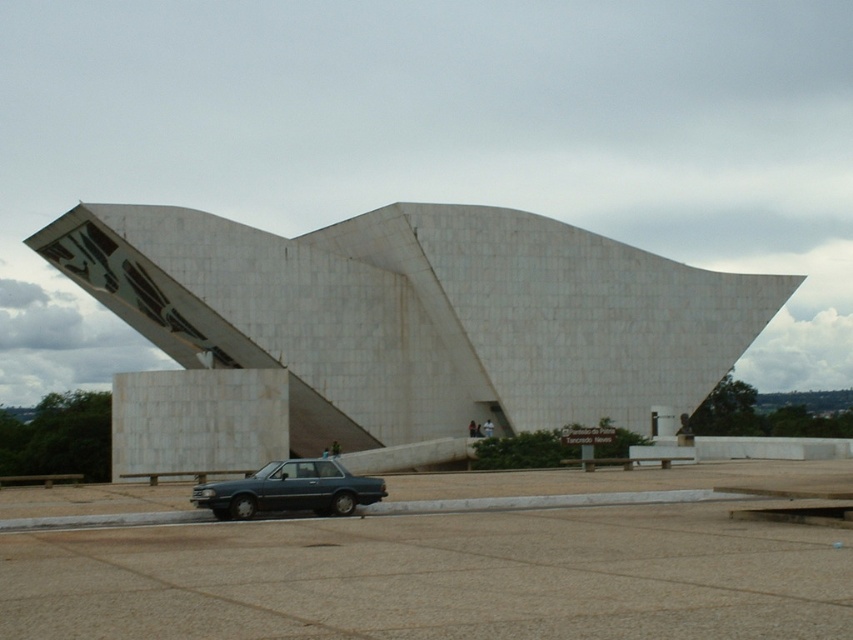
In the scene shown: You are a delivery person who needs to park your 5.5 meter long truck between the white marble building at center and the matte blue sedan at lower center. Can you safely park your truck there without overlapping either structure?

The distance between the white marble building at center and the matte blue sedan at lower center is 21.01 meters. Since your truck is only 5.5 meters long, there is ample space to park it safely between them without overlapping either structure.

Looking at this image, you are standing in front of the building and want to walk from point A to point B. Point A is at coordinates point (396, 332) and point B is at coordinates point (242, 518). Which point is closer to you when you start walking?

Point A at coordinates point (396, 332) is closer to you because it is further to the viewer than point B at coordinates point (242, 518).

You are a photographer planning to take a wide shot of the white marble building at center. You need to ensure the matte blue sedan at lower center doesn not block the view. Based on their sizes, can you fit both in the frame without the car obscuring the building?

The white marble building at center is larger in size than the matte blue sedan at lower center, so it is possible to frame both in a wide shot without the car blocking the building as long as the building is positioned centrally and the car is placed towards the edge of the frame.